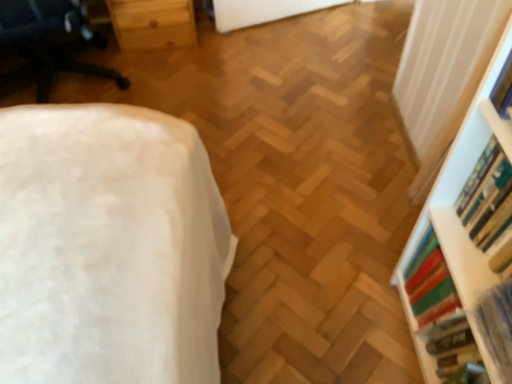
Question: Considering the relative sizes of white plastic shelf at right and hardcover book at right, the 3th book positioned from the top, in the image provided, is white plastic shelf at right shorter than hardcover book at right, the 3th book positioned from the top,?

Choices:
 (A) yes
 (B) no

Answer: (B)

Question: Is white plastic shelf at right at the right side of hardcover book at right, the 3th book positioned from the top?

Choices:
 (A) no
 (B) yes

Answer: (B)

Question: Could you tell me if white plastic shelf at right is facing hardcover book at right, the 3th book positioned from the top?

Choices:
 (A) no
 (B) yes

Answer: (B)

Question: Is white plastic shelf at right looking in the opposite direction of hardcover book at right, marked as the 2th book in a bottom-to-top arrangement?

Choices:
 (A) no
 (B) yes

Answer: (B)

Question: From the image's perspective, is white plastic shelf at right above hardcover book at right, the 3th book positioned from the top?

Choices:
 (A) yes
 (B) no

Answer: (A)

Question: Are white plastic shelf at right and hardcover book at right, marked as the 2th book in a bottom-to-top arrangement, far apart?

Choices:
 (A) no
 (B) yes

Answer: (A)

Question: Is hardcover book at right, acting as the 2th book starting from the top, facing away from white plastic shelf at right?

Choices:
 (A) yes
 (B) no

Answer: (A)

Question: Considering the relative positions of hardcover book at right, acting as the 2th book starting from the top, and white plastic shelf at right in the image provided, is hardcover book at right, acting as the 2th book starting from the top, in front of white plastic shelf at right?

Choices:
 (A) yes
 (B) no

Answer: (B)

Question: Can you confirm if hardcover book at right, acting as the 2th book starting from the top, is positioned to the right of white plastic shelf at right?

Choices:
 (A) yes
 (B) no

Answer: (B)

Question: From a real-world perspective, is hardcover book at right, acting as the 2th book starting from the top, on top of white plastic shelf at right?

Choices:
 (A) no
 (B) yes

Answer: (B)

Question: From the image's perspective, would you say hardcover book at right, acting as the 2th book starting from the top, is positioned over white plastic shelf at right?

Choices:
 (A) yes
 (B) no

Answer: (A)

Question: Is the depth of hardcover book at right, acting as the 2th book starting from the top, greater than that of white plastic shelf at right?

Choices:
 (A) no
 (B) yes

Answer: (B)

Question: Considering the relative sizes of hardcover book at right, marked as the 2th book in a bottom-to-top arrangement, and hardcover book at upper right, arranged as the 1th book when viewed from the top, in the image provided, is hardcover book at right, marked as the 2th book in a bottom-to-top arrangement, bigger than hardcover book at upper right, arranged as the 1th book when viewed from the top,?

Choices:
 (A) yes
 (B) no

Answer: (A)